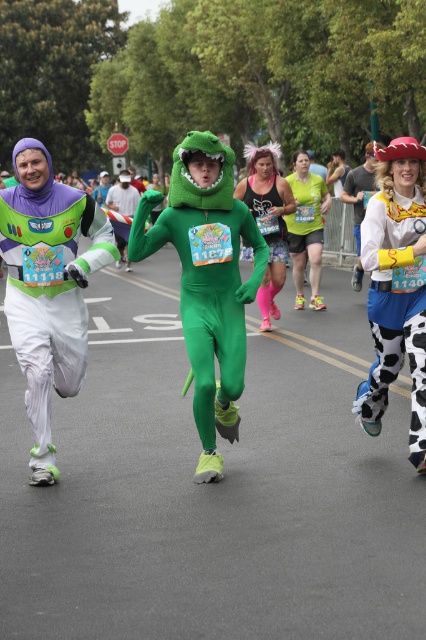
Question: Does matte purple and green costume at left appear on the right side of neon green spandex at center?

Choices:
 (A) yes
 (B) no

Answer: (B)

Question: From the image, what is the correct spatial relationship of cow print leggings at right in relation to neon green spandex at center?

Choices:
 (A) right
 (B) left

Answer: (B)

Question: Which point is closer to the camera?

Choices:
 (A) matte purple and green costume at left
 (B) green spandex suit at center

Answer: (B)

Question: Which of these objects is positioned farthest from the cow print leggings at right?

Choices:
 (A) glow-in-the-dark fabric tank top at center
 (B) matte purple and green costume at left
 (C) neon green spandex at center

Answer: (C)

Question: Can you confirm if glow-in-the-dark fabric tank top at center is thinner than neon green spandex at center?

Choices:
 (A) yes
 (B) no

Answer: (A)

Question: Which of the following is the closest to the observer?

Choices:
 (A) (16, 340)
 (B) (394, 301)

Answer: (A)